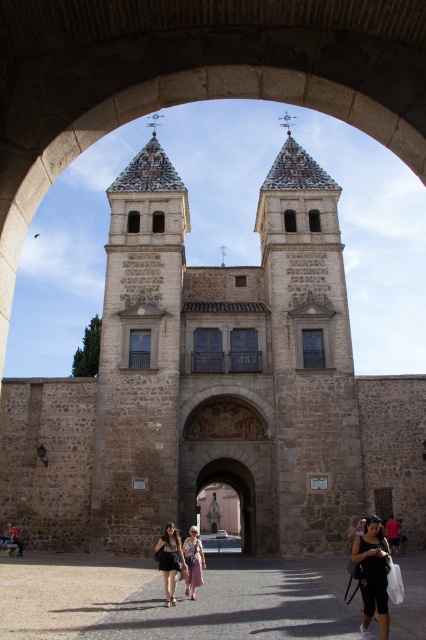
You are standing in front of the historic stone structure and notice the gray stone church at center and the matte black bag at lower right. Which object is bigger in size?

The gray stone church at center is larger in size compared to the matte black bag at lower right.

You are standing inside the archway looking at the historic stone structure. There are two points marked on the structure. Which point is closer to you, point 1 at coordinates [382,621] or point 2 at coordinates [203,563]?

Point 1 at coordinates [382,621] is closer to the viewer than point 2 at coordinates [203,563].

You are standing at the entrance of the historic stone structure and notice a gray stone church at center and a matte black bag at lower right. Which object occupies more horizontal space in the image?

The gray stone church at center occupies more horizontal space because its width is larger than that of the matte black bag at lower right.